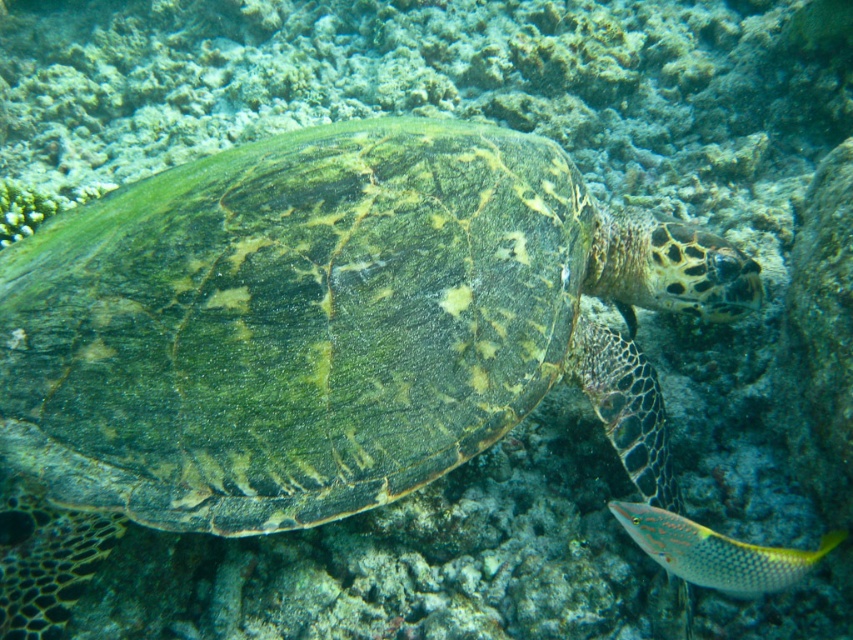
You are a marine biologist observing the underwater scene. You notice the green textured shell at center and the shiny yellow fish at lower right. Which object is located higher in the water column?

The green textured shell at center is positioned over the shiny yellow fish at lower right, meaning it is higher in the water column.

You are a marine biologist observing this underwater scene. You notice the green textured shell at center and the shiny yellow fish at lower right. Which of these two objects is bigger in size?

The green textured shell at center is larger in size than the shiny yellow fish at lower right.

You are a marine biologist observing this underwater scene. You notice the green textured shell at center and the shiny yellow fish at lower right. Which object is located more to the left in the image?

The green textured shell at center is positioned more to the left than the shiny yellow fish at lower right.